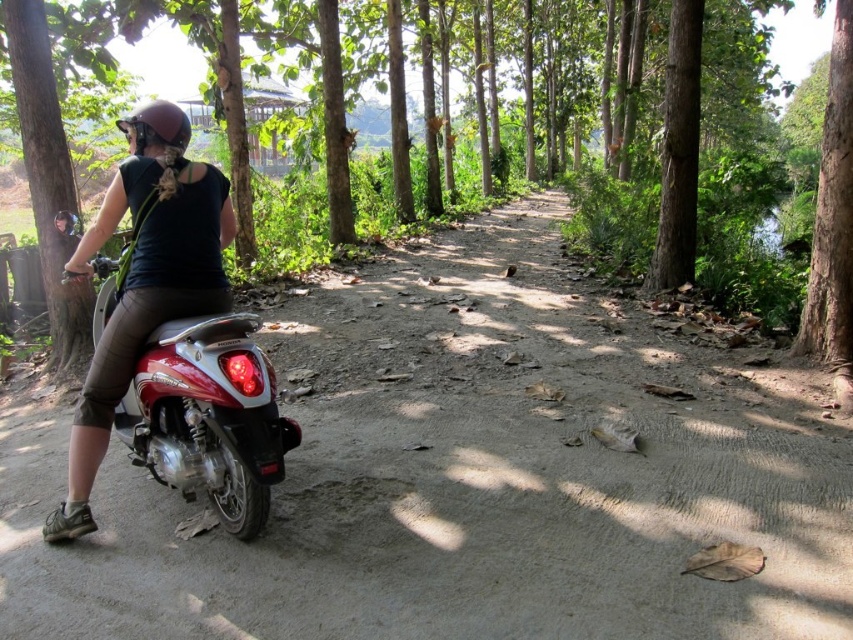
Does shiny red motorcycle at center-left appear on the left side of brown matte helmet at upper left?

Incorrect, shiny red motorcycle at center-left is not on the left side of brown matte helmet at upper left.

The height and width of the screenshot is (640, 853). What are the coordinates of `shiny red motorcycle at center-left` in the screenshot? It's located at (209, 417).

The image size is (853, 640). What are the coordinates of `shiny red motorcycle at center-left` in the screenshot? It's located at (209, 417).

Which is more to the left, shiny red motorcycle at center-left or brown wood tree at center?

shiny red motorcycle at center-left is more to the left.

Does shiny red motorcycle at center-left appear over brown wood tree at center?

No, shiny red motorcycle at center-left is not above brown wood tree at center.

What are the coordinates of `shiny red motorcycle at center-left` in the screenshot? It's located at (209, 417).

The height and width of the screenshot is (640, 853). Identify the location of shiny red motorcycle at center-left. (209, 417).

Between point (45, 220) and point (132, 120), which one is positioned in front?

Positioned in front is point (132, 120).

Which is more to the right, brushed metal tree at left or brown matte helmet at upper left?

From the viewer's perspective, brushed metal tree at left appears more on the right side.

Who is more forward, (33,147) or (135,122)?

Positioned in front is point (135,122).

Find the location of a particular element. This screenshot has width=853, height=640. brushed metal tree at left is located at coordinates (47, 179).